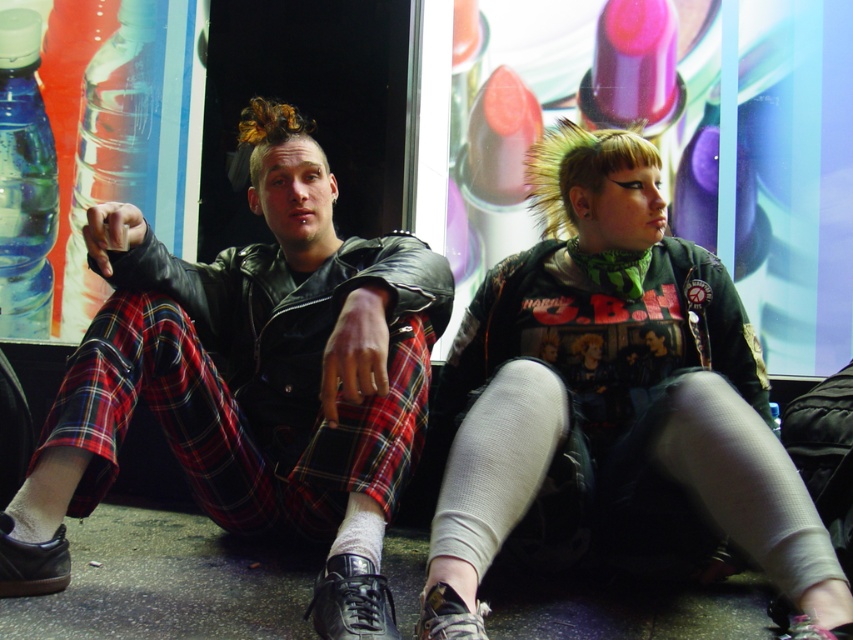
Based on the photo, can you confirm if clear plastic bottle at left is smaller than transparent plastic bottle at left?

No.

Consider the image. Is clear plastic bottle at left to the left of transparent plastic bottle at left from the viewer's perspective?

No, clear plastic bottle at left is not to the left of transparent plastic bottle at left.

Image resolution: width=853 pixels, height=640 pixels. Find the location of `clear plastic bottle at left`. clear plastic bottle at left is located at coordinates (113, 144).

Which is below, leather jacket at center or matte green t-shirt at center?

matte green t-shirt at center is below.

Does leather jacket at center appear on the right side of matte green t-shirt at center?

In fact, leather jacket at center is to the left of matte green t-shirt at center.

Which is in front, point (300, 508) or point (461, 442)?

Point (461, 442) is more forward.

Locate an element on the screen. This screenshot has width=853, height=640. leather jacket at center is located at coordinates (251, 380).

Does matte green t-shirt at center lie in front of transparent plastic bottle at left?

Yes, it is in front of transparent plastic bottle at left.

How much distance is there between matte green t-shirt at center and transparent plastic bottle at left?

matte green t-shirt at center is 2.06 meters away from transparent plastic bottle at left.

The width and height of the screenshot is (853, 640). What do you see at coordinates (612, 396) in the screenshot? I see `matte green t-shirt at center` at bounding box center [612, 396].

The height and width of the screenshot is (640, 853). I want to click on matte green t-shirt at center, so coord(612,396).